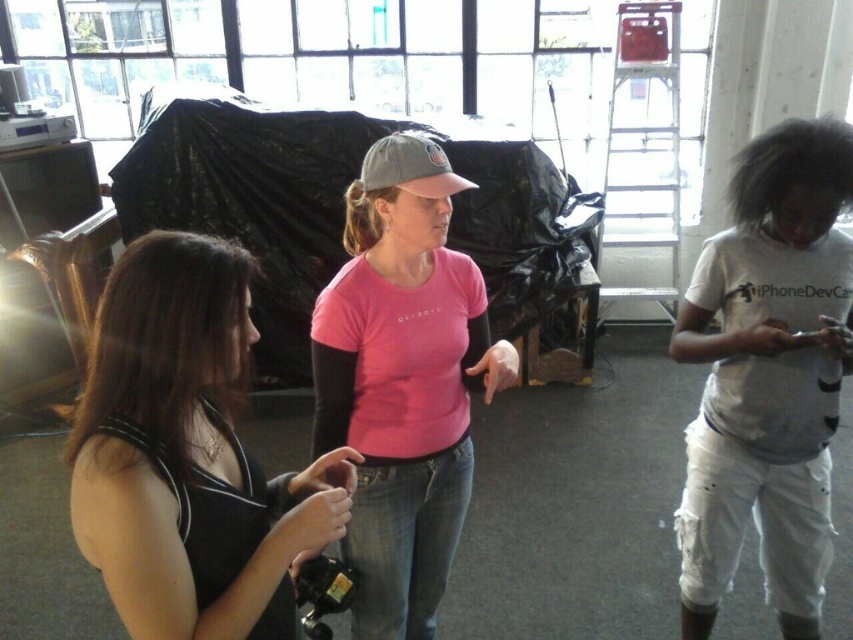
You are standing in the room and want to hand a tool to the person wearing the black matte tank top at center and the gray fabric baseball cap at center. If you start from the left side of the room, which item should you reach for first?

The black matte tank top at center is to the left of the gray fabric baseball cap at center, so you should reach for the black matte tank top at center first.

You are standing at the entrance of the room and want to locate the black matte tank top at center. Based on the coordinates provided, where would you find it?

The black matte tank top at center is located at coordinates point (189, 454).